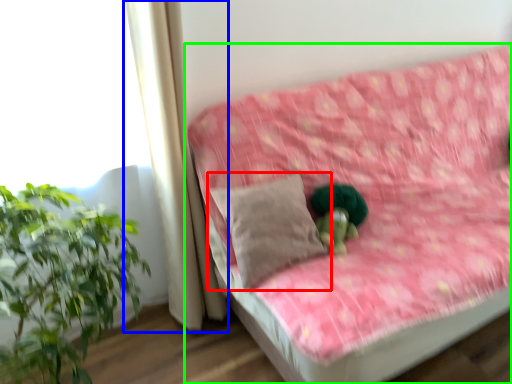
Question: Which is nearer to the pillow (highlighted by a red box)? curtain (highlighted by a blue box) or studio couch (highlighted by a green box).

Choices:
 (A) curtain
 (B) studio couch

Answer: (A)